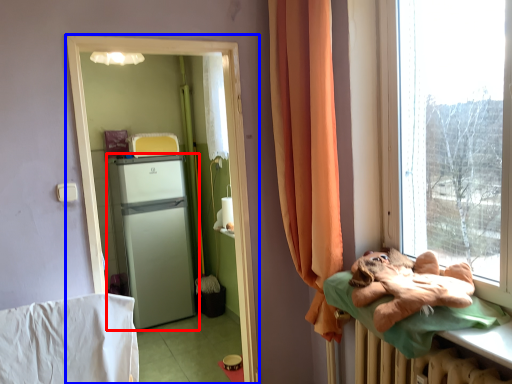
Question: Among these objects, which one is nearest to the camera, refrigerator (highlighted by a red box) or screen door (highlighted by a blue box)?

Choices:
 (A) refrigerator
 (B) screen door

Answer: (B)